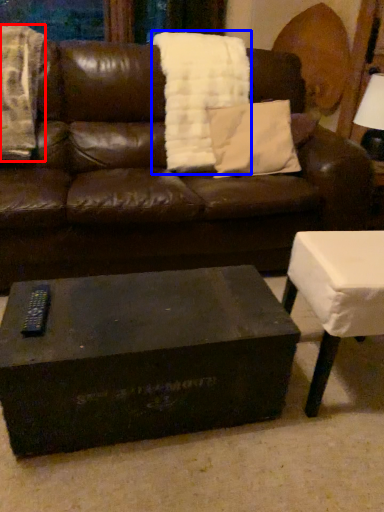
Question: Which object is closer to the camera taking this photo, blanket (highlighted by a red box) or blanket (highlighted by a blue box)?

Choices:
 (A) blanket
 (B) blanket

Answer: (A)